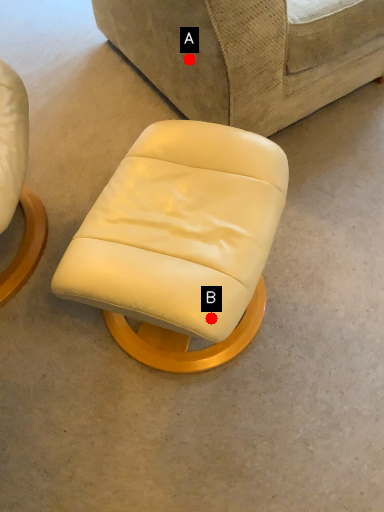
Question: Two points are circled on the image, labeled by A and B beside each circle. Which point appears closest to the camera in this image?

Choices:
 (A) A is closer
 (B) B is closer

Answer: (B)